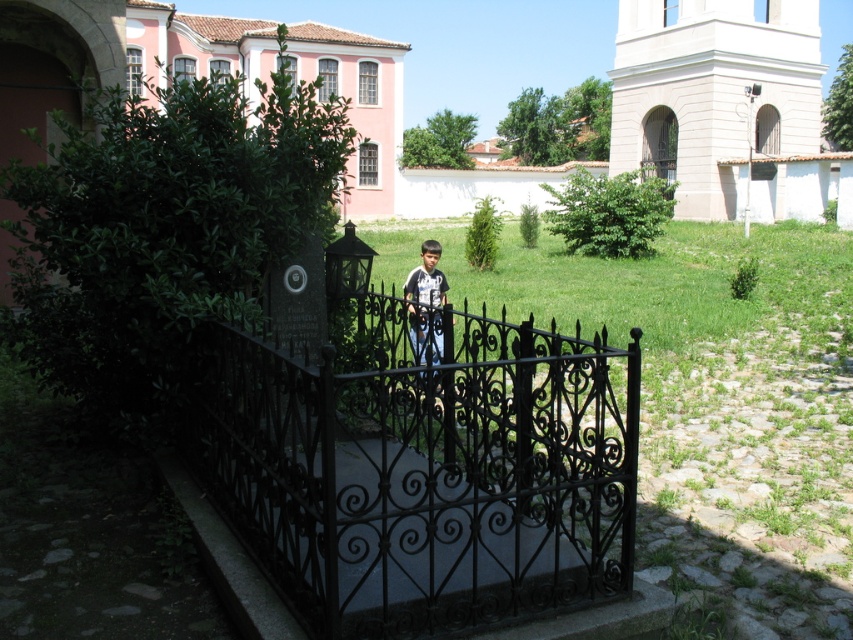
Question: Which point is closer to the camera taking this photo?

Choices:
 (A) (653, 54)
 (B) (431, 275)
 (C) (421, 516)

Answer: (C)

Question: Estimate the real-world distances between objects in this image. Which object is farther from the white stone church at upper right?

Choices:
 (A) matte black shirt at center
 (B) black wrought iron gate at center

Answer: (A)

Question: Which point is closer to the camera?

Choices:
 (A) (639, 92)
 (B) (451, 400)
 (C) (430, 291)

Answer: (B)

Question: Is black wrought iron gate at center bigger than matte black shirt at center?

Choices:
 (A) no
 (B) yes

Answer: (B)

Question: Is black wrought iron gate at center positioned before matte black shirt at center?

Choices:
 (A) yes
 (B) no

Answer: (A)

Question: Can you confirm if white stone church at upper right is thinner than matte black shirt at center?

Choices:
 (A) yes
 (B) no

Answer: (B)